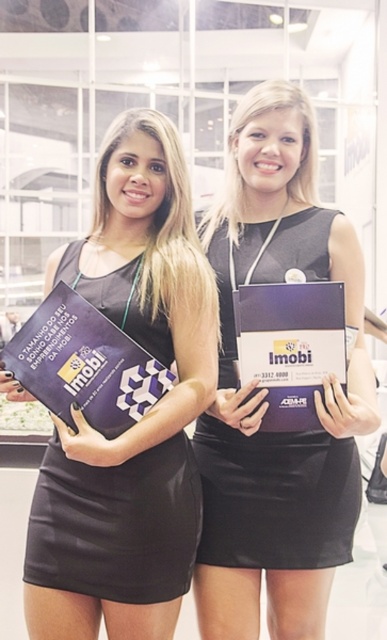
Question: Can you confirm if black leather dress at center is bigger than satin black dress at center?

Choices:
 (A) yes
 (B) no

Answer: (A)

Question: Does satin black dress at center have a larger size compared to matte purple booklet at center?

Choices:
 (A) yes
 (B) no

Answer: (A)

Question: Considering the real-world distances, which object is farthest from the satin black dress at center?

Choices:
 (A) matte purple booklet at center
 (B) black leather dress at center

Answer: (A)

Question: Can you confirm if satin black dress at center is bigger than matte purple booklet at center?

Choices:
 (A) no
 (B) yes

Answer: (B)

Question: Which point is closer to the camera taking this photo?

Choices:
 (A) (34, 544)
 (B) (308, 348)

Answer: (B)

Question: Which point is farther to the camera?

Choices:
 (A) (301, 413)
 (B) (181, 589)

Answer: (B)